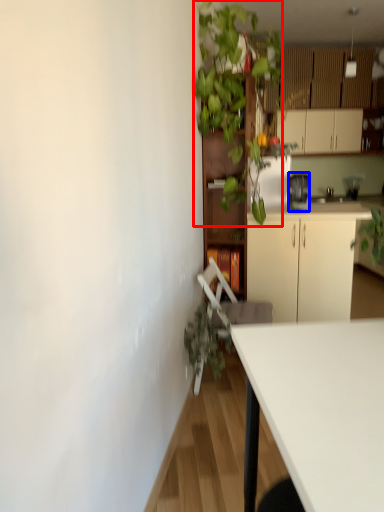
Question: Among these objects, which one is farthest to the camera, vegetation (highlighted by a red box) or appliance (highlighted by a blue box)?

Choices:
 (A) vegetation
 (B) appliance

Answer: (B)